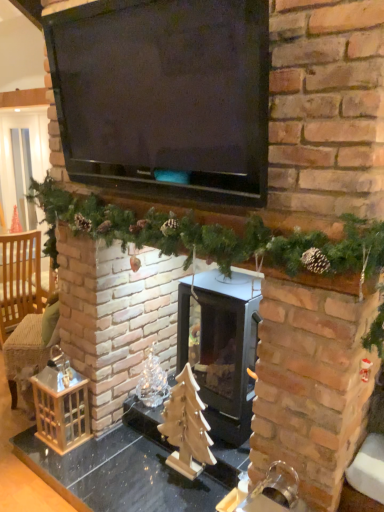
Question: Can you confirm if light brown woven armchair at left is smaller than wooden table at center?

Choices:
 (A) no
 (B) yes

Answer: (A)

Question: Is light brown woven armchair at left further to the viewer compared to wooden table at center?

Choices:
 (A) no
 (B) yes

Answer: (B)

Question: Is wooden table at center located within light brown woven armchair at left?

Choices:
 (A) no
 (B) yes

Answer: (A)

Question: From the image's perspective, is light brown woven armchair at left on wooden table at center?

Choices:
 (A) yes
 (B) no

Answer: (A)

Question: From a real-world perspective, is light brown woven armchair at left on top of wooden table at center?

Choices:
 (A) yes
 (B) no

Answer: (A)

Question: Does point (253, 322) appear closer or farther from the camera than point (119, 81)?

Choices:
 (A) closer
 (B) farther

Answer: (B)

Question: Is black glass wood burning stove at center spatially inside black matte television at upper center, or outside of it?

Choices:
 (A) inside
 (B) outside

Answer: (B)

Question: Is black glass wood burning stove at center taller or shorter than black matte television at upper center?

Choices:
 (A) short
 (B) tall

Answer: (B)

Question: From the image's perspective, is black glass wood burning stove at center above or below black matte television at upper center?

Choices:
 (A) above
 (B) below

Answer: (B)

Question: Relative to black matte television at upper center, is green garland at center in front or behind?

Choices:
 (A) front
 (B) behind

Answer: (B)

Question: From their relative heights in the image, would you say green garland at center is taller or shorter than black matte television at upper center?

Choices:
 (A) tall
 (B) short

Answer: (B)

Question: Is green garland at center spatially inside black matte television at upper center, or outside of it?

Choices:
 (A) outside
 (B) inside

Answer: (A)

Question: From a real-world perspective, relative to black matte television at upper center, is green garland at center vertically above or below?

Choices:
 (A) below
 (B) above

Answer: (A)

Question: From the image's perspective, is green garland at center above or below wooden table at center?

Choices:
 (A) below
 (B) above

Answer: (B)

Question: Looking at the image, does green garland at center seem bigger or smaller compared to wooden table at center?

Choices:
 (A) big
 (B) small

Answer: (B)